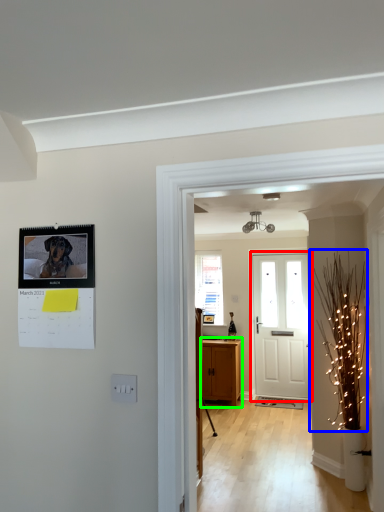
Question: Based on their relative distances, which object is farther from door (highlighted by a red box)? Choose from christmas light (highlighted by a blue box) and cabinetry (highlighted by a green box).

Choices:
 (A) christmas light
 (B) cabinetry

Answer: (A)